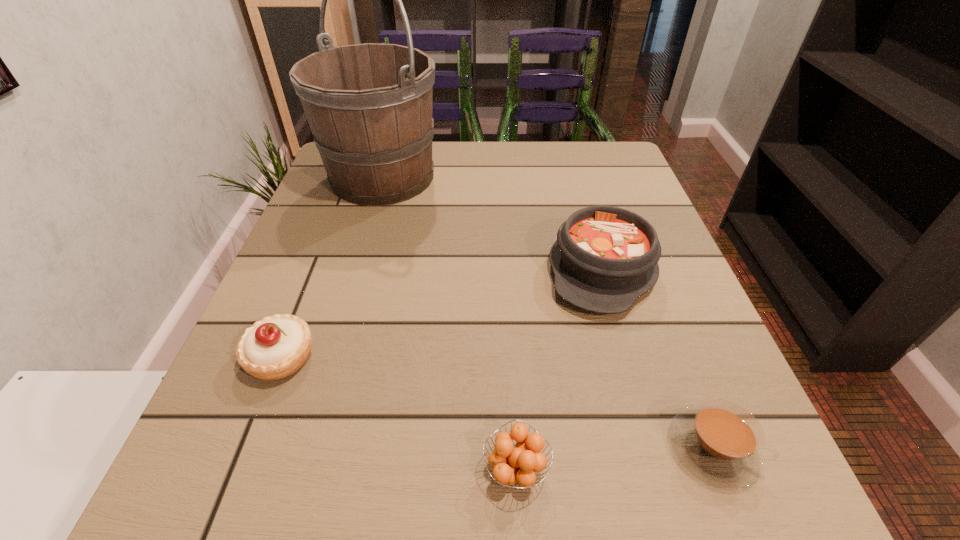
At what (x,y) coordinates should I click in order to perform the action: click on free space located on the back of the orange fruit. Please return your answer as a coordinate pair (x, y). This screenshot has width=960, height=540. Looking at the image, I should click on (505, 281).

Identify the location of object situated at the far edge. (369, 106).

At what (x,y) coordinates should I click in order to perform the action: click on cappuccino situated at the near edge. Please return your answer as a coordinate pair (x, y). The height and width of the screenshot is (540, 960). Looking at the image, I should click on (719, 442).

The height and width of the screenshot is (540, 960). Identify the location of orange fruit that is at the near edge. (510, 465).

At what (x,y) coordinates should I click in order to perform the action: click on bucket present at the left edge. Please return your answer as a coordinate pair (x, y). This screenshot has width=960, height=540. Looking at the image, I should click on (369, 106).

Locate an element on the screen. The width and height of the screenshot is (960, 540). pastry that is at the left edge is located at coordinates (275, 347).

Image resolution: width=960 pixels, height=540 pixels. Find the location of `casserole that is at the right edge`. casserole that is at the right edge is located at coordinates (605, 258).

This screenshot has height=540, width=960. In order to click on cappuccino that is at the right edge in this screenshot , I will do `click(719, 442)`.

Locate an element on the screen. object that is at the far left corner is located at coordinates (369, 106).

In order to click on object at the near right corner in this screenshot , I will do `click(719, 442)`.